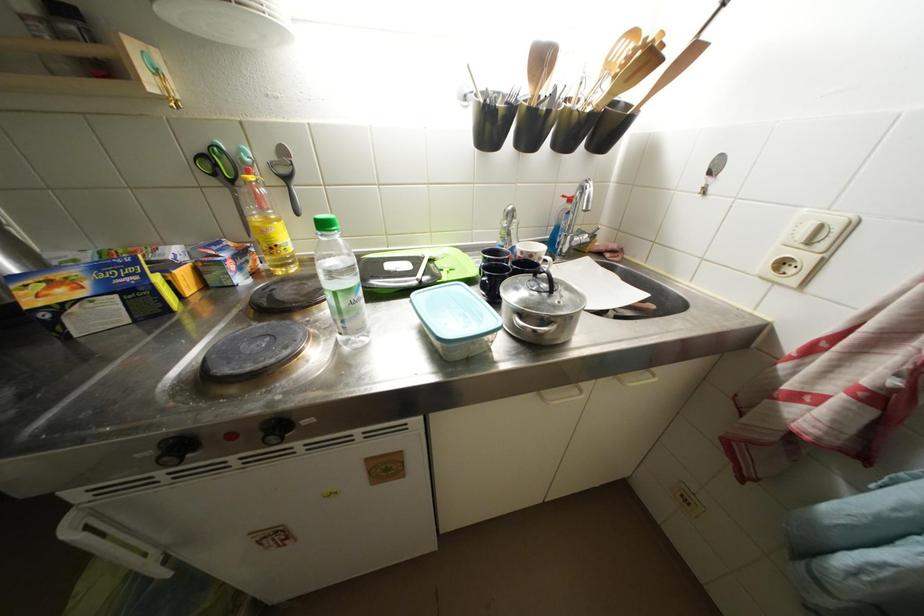
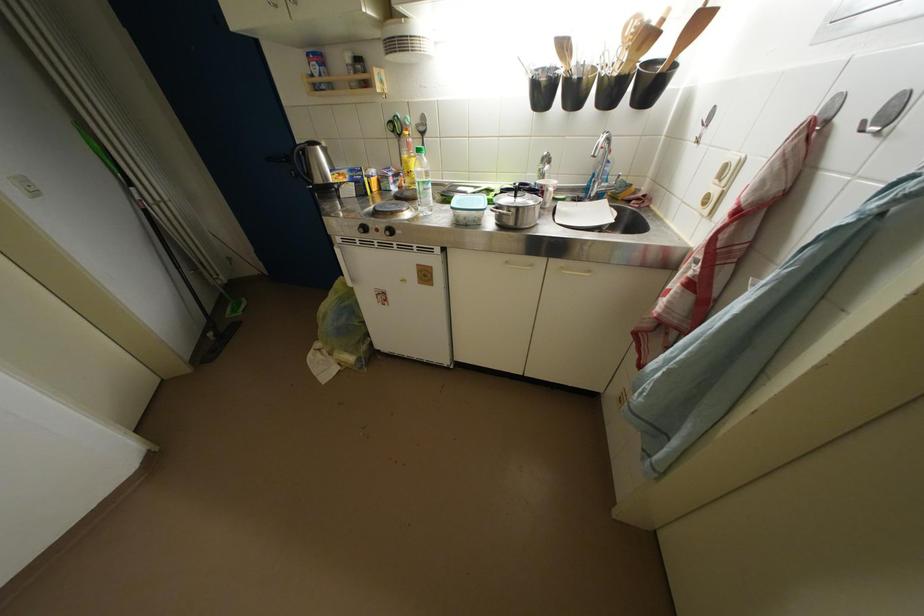
The point at (238,185) is marked in the first image. Where is the corresponding point in the second image?

(407, 140)